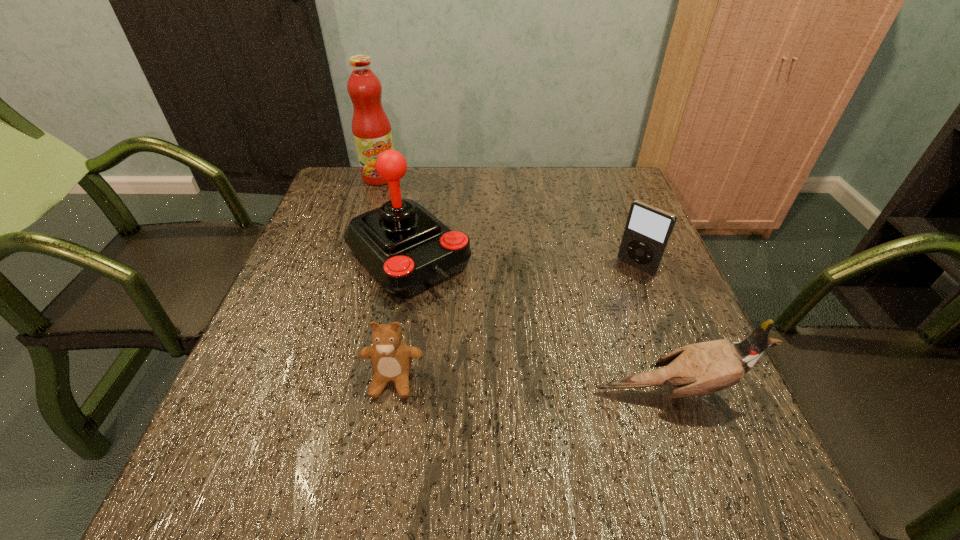
The height and width of the screenshot is (540, 960). In order to click on vacant spot on the desktop that is between the shortest object and the bird and is positioned on the front-facing side of the fourth tallest object in this screenshot , I will do `click(520, 386)`.

Identify the location of vacant space on the desktop that is between the shortest object and the bird and is positioned on the front label of the fruit juice. The height and width of the screenshot is (540, 960). coord(495,384).

Image resolution: width=960 pixels, height=540 pixels. Find the location of `free space on the desktop that is between the shortest object and the bird and is positioned on the base of the second tallest object`. free space on the desktop that is between the shortest object and the bird and is positioned on the base of the second tallest object is located at coordinates (540, 386).